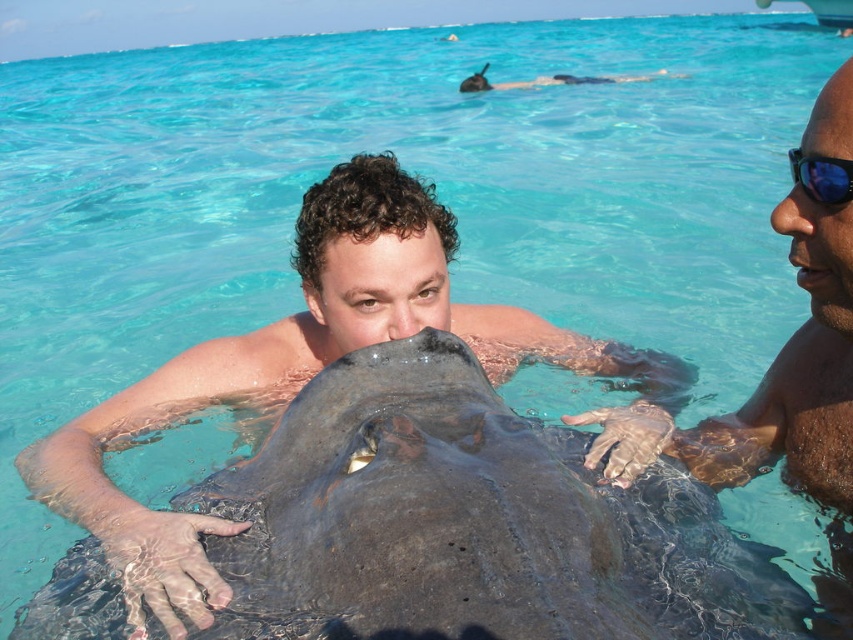
Question: Can you confirm if smooth gray stingray at center is positioned above smooth skin man at right?

Choices:
 (A) yes
 (B) no

Answer: (B)

Question: Which point is farther to the camera?

Choices:
 (A) (469, 371)
 (B) (844, 472)

Answer: (A)

Question: Which point is farther from the camera taking this photo?

Choices:
 (A) (338, 412)
 (B) (827, 189)

Answer: (A)

Question: Does smooth gray stingray at center have a smaller size compared to black matte stingray at upper center?

Choices:
 (A) yes
 (B) no

Answer: (A)

Question: Can you confirm if blue reflective plastic goggles at upper right is positioned below black matte stingray at upper center?

Choices:
 (A) no
 (B) yes

Answer: (B)

Question: Which point is closer to the camera taking this photo?

Choices:
 (A) (544, 621)
 (B) (480, 72)
 (C) (808, 176)
 (D) (793, 464)

Answer: (A)